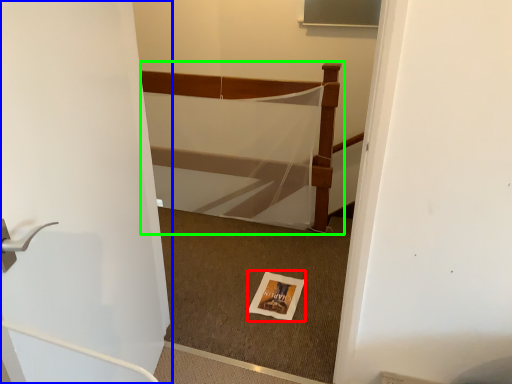
Question: Which object is positioned closest to postcard (highlighted by a red box)? Select from door (highlighted by a blue box) and bed (highlighted by a green box).

Choices:
 (A) door
 (B) bed

Answer: (B)